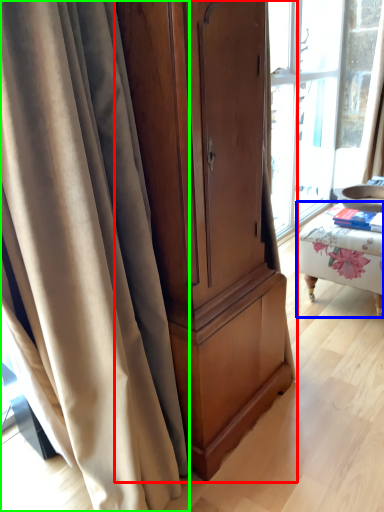
Question: Which object is the closest to the cabinetry (highlighted by a red box)? Choose among these: furniture (highlighted by a blue box) or curtain (highlighted by a green box).

Choices:
 (A) furniture
 (B) curtain

Answer: (B)